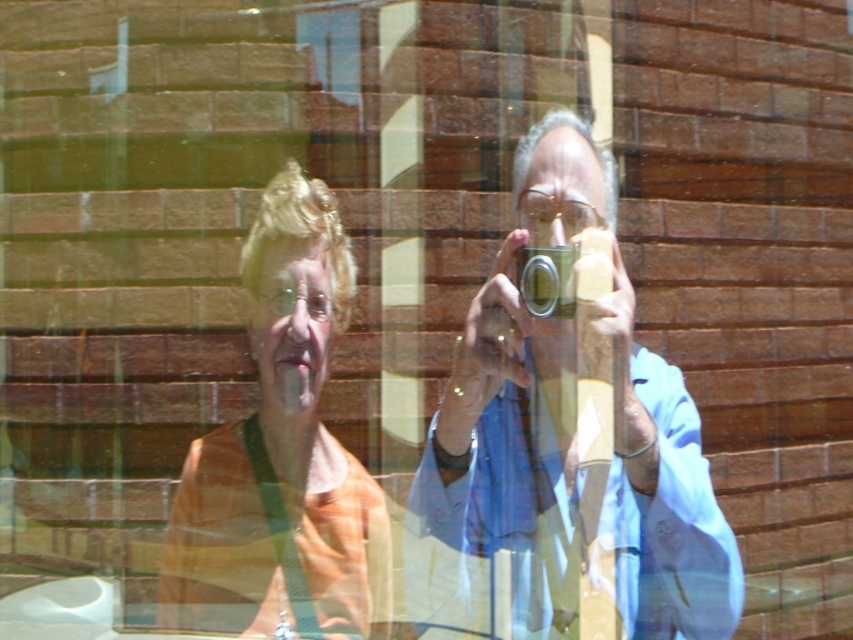
Based on the reflection shown in the image, which object is closer to the reflective surface, the matte blue shirt at center or the orange fabric at center?

The matte blue shirt at center is closer to the reflective surface because it is in front of the orange fabric at center in the reflection.

You are standing in front of a reflective surface and see the matte blue shirt at center and the orange fabric at center in the reflection. Which object is positioned to the right in this reflection?

The matte blue shirt at center is to the right of the orange fabric at center in the reflection.

You are a photographer analyzing the reflection in the window. You notice two central elements in the reflection, the matte blue shirt at center and the orange fabric at center. Which one appears larger in the reflection?

The matte blue shirt at center appears larger than the orange fabric at center in the reflection.